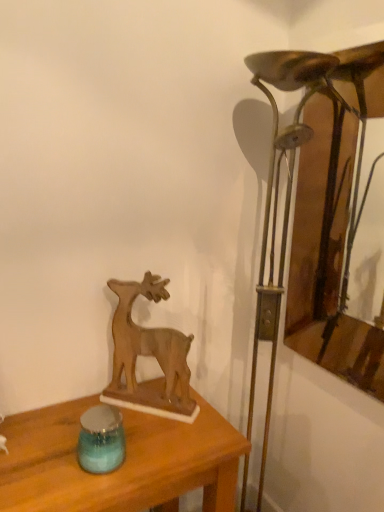
Where is `free space in front of blue glass candle holder at lower left`? free space in front of blue glass candle holder at lower left is located at coordinates (84, 492).